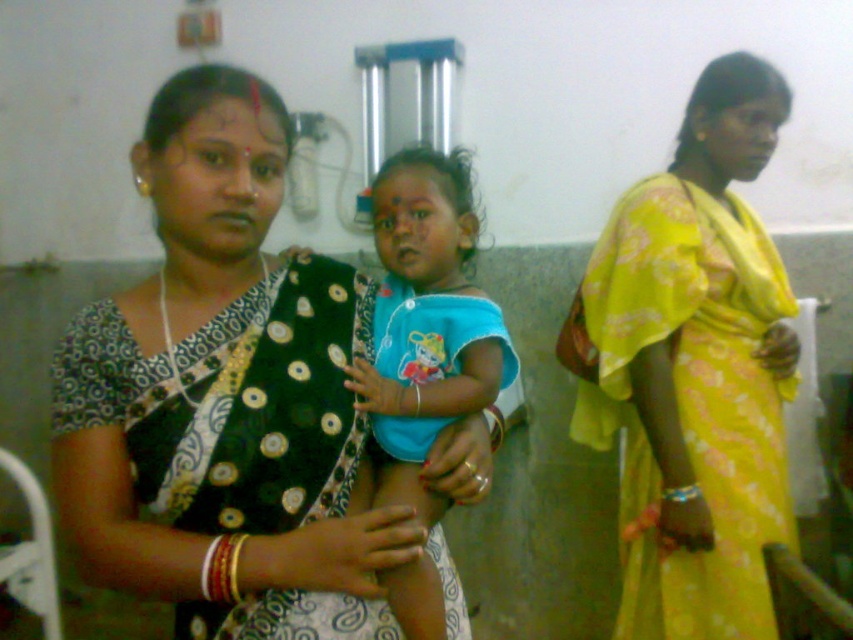
Who is positioned more to the left, yellow floral saree at right or blue cotton dress at center?

Answer: Positioned to the left is blue cotton dress at center.

The width and height of the screenshot is (853, 640). I want to click on yellow floral saree at right, so click(x=693, y=369).

Is black satin saree at center bigger than yellow floral saree at right?

Incorrect, black satin saree at center is not larger than yellow floral saree at right.

Which is below, black satin saree at center or yellow floral saree at right?

Positioned lower is black satin saree at center.

Is point (114, 442) positioned after point (764, 154)?

That is False.

I want to click on black satin saree at center, so click(x=224, y=396).

Is black satin saree at center smaller than blue cotton dress at center?

Incorrect, black satin saree at center is not smaller in size than blue cotton dress at center.

Is black satin saree at center thinner than blue cotton dress at center?

No, black satin saree at center is not thinner than blue cotton dress at center.

Who is more distant from viewer, (x=219, y=362) or (x=463, y=161)?

The point (x=463, y=161) is behind.

I want to click on black satin saree at center, so click(224, 396).